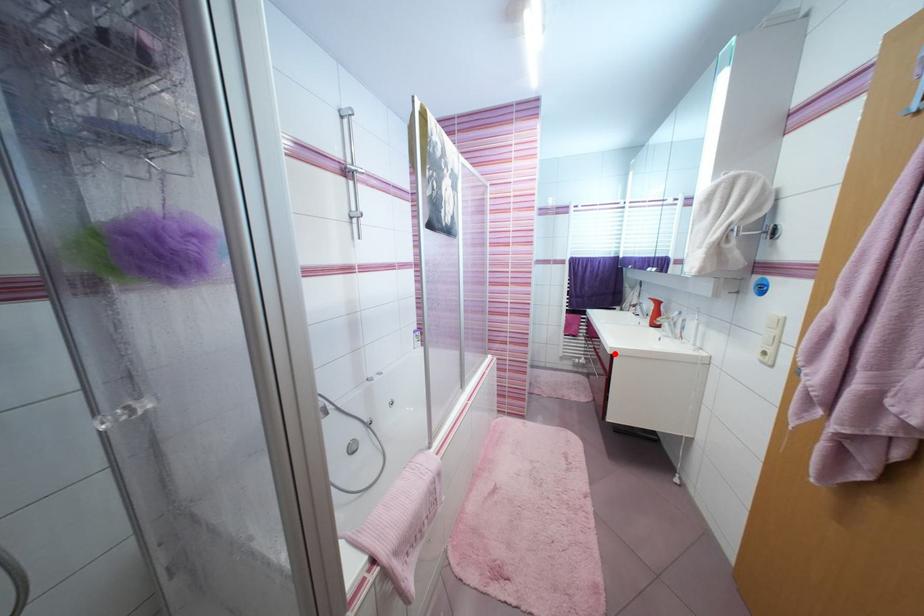
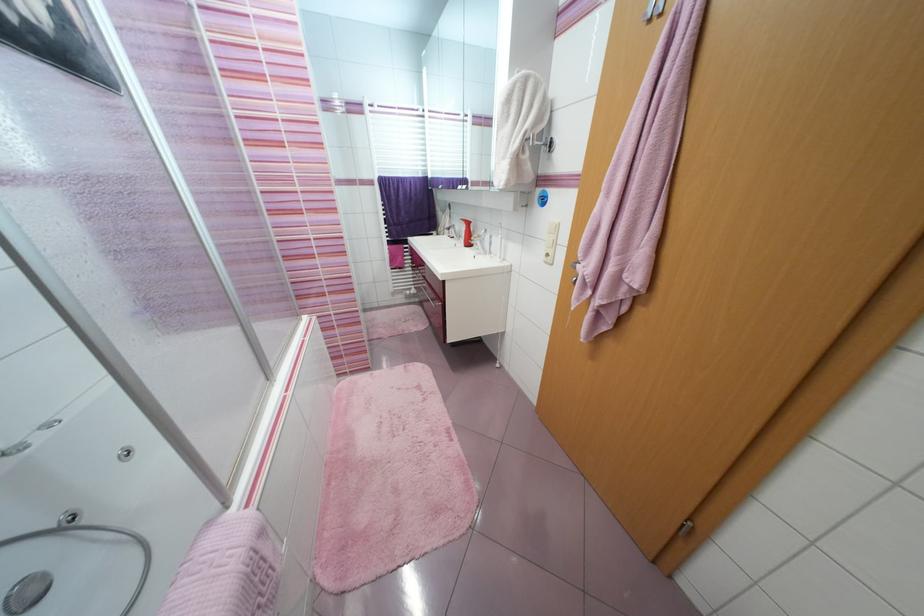
Question: I am providing you with two images of the same scene from different viewpoints. A red point is shown in image1. For the corresponding object point in image2, is it positioned nearer or farther from the camera?

Choices:
 (A) Nearer
 (B) Farther

Answer: (B)